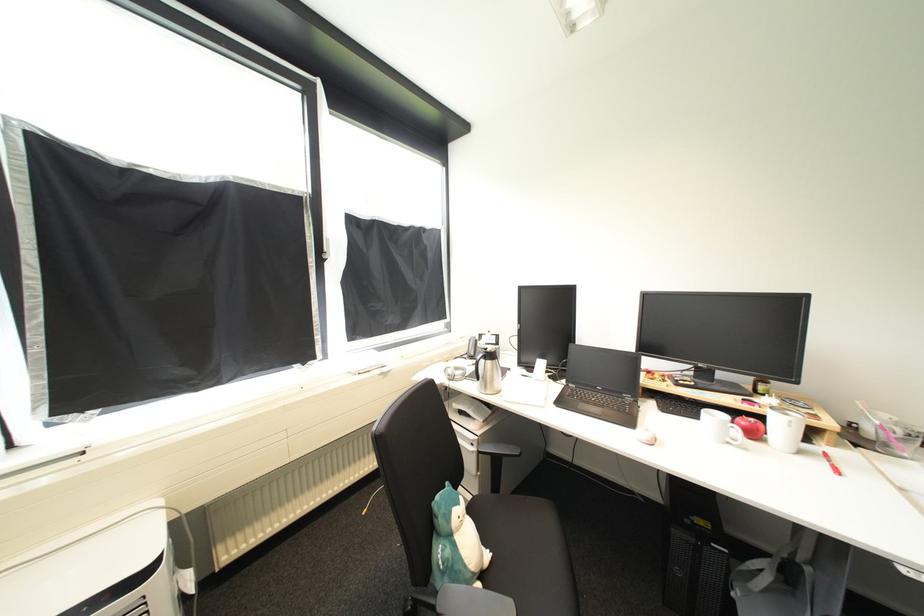
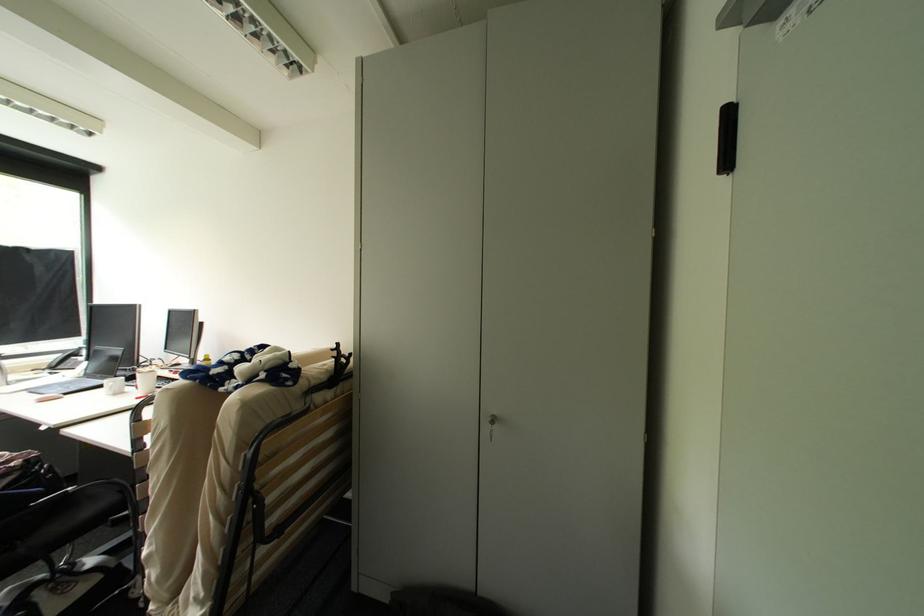
The images are taken continuously from a first-person perspective. In which direction are you moving?

The cameraman walked toward right, backward.